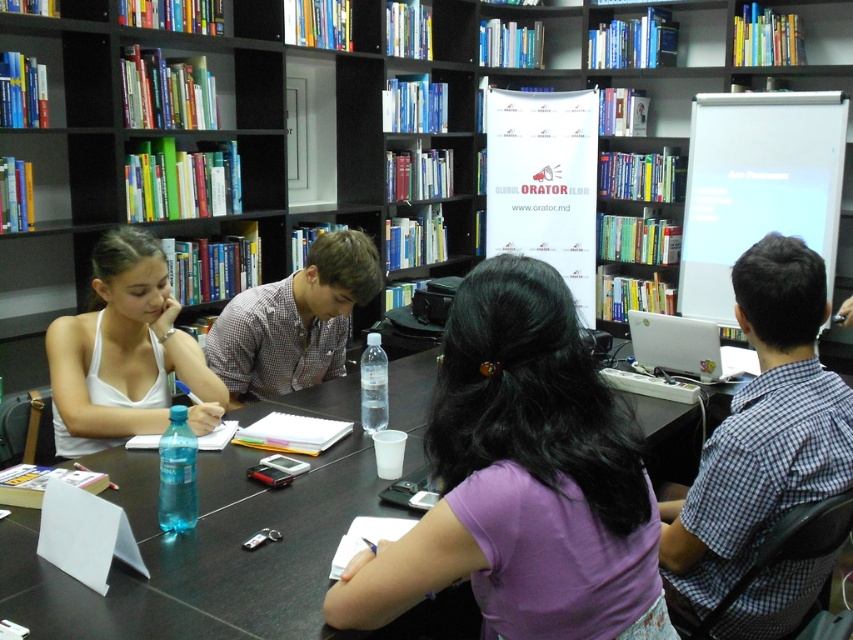
You are sitting at the rectangular table in the library. There are two points marked on the table. The first point is at coordinates point (x=117, y=259) and the second point is at point (x=727, y=374). If you want to place a small electronic device between these two points, which point should you place it closer to so that it is closer to the person sitting on the left who is writing in their notebook?

The small electronic device should be placed closer to point (x=117, y=259) because it is in front of point (x=727, y=374). Since the person on the left is writing, placing the device closer to the front point would make it more accessible to them.

You are sitting at the black plastic table at center and want to pass a pen to the person wearing the white matte tank top at left. Which direction should you pass the pen to reach them?

The black plastic table at center is positioned on the right side of the white matte tank top at left, so you should pass the pen to the left to reach them.

You are standing at the location of the point marked at coordinates (154, 280). If you want to greet someone across the room, which direction should you face to look towards the door located directly opposite the entrance?

The point marked at coordinates (154, 280) is 6.80 feet away from the viewer. To determine the correct direction to face, you would need to consider the room layout and the position of the entrance relative to the door. However, based on the provided information, the answer cannot be definitively determined as the scene description does not specify the room orientation or the location of the entrance and exit doors.